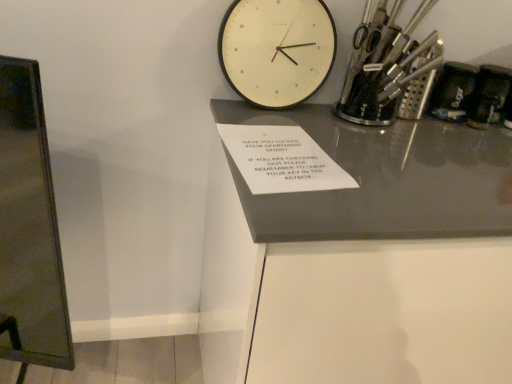
Where is `vacant area that is in front of white matte wall clock at upper center`? This screenshot has width=512, height=384. vacant area that is in front of white matte wall clock at upper center is located at coordinates (270, 127).